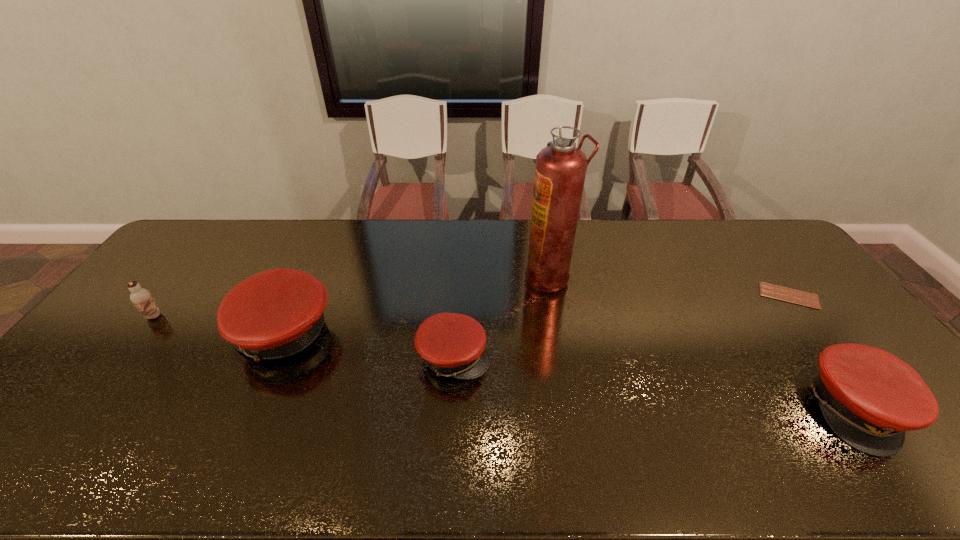
Locate an element on the screen. This screenshot has width=960, height=540. free location located 0.080m on the front of the tallest cap with an emblem is located at coordinates (202, 334).

Find the location of a particular element. vacant area located on the front of the tallest cap with an emblem is located at coordinates (174, 334).

This screenshot has width=960, height=540. I want to click on free spot located 0.150m on the front of the tallest cap with an emblem, so click(x=178, y=334).

At what (x,y) coordinates should I click in order to perform the action: click on vacant space situated on the front of the third object from left to right with an emblem. Please return your answer as a coordinate pair (x, y). Looking at the image, I should click on (600, 356).

Locate an element on the screen. The width and height of the screenshot is (960, 540). vacant region located 0.270m on the front of the shortest object is located at coordinates (857, 384).

This screenshot has width=960, height=540. Identify the location of free region located 0.130m on the side of the fire extinguisher with the label. (485, 277).

Locate an element on the screen. free location located on the side of the fire extinguisher with the label is located at coordinates (479, 277).

Locate an element on the screen. vacant space situated on the side of the fire extinguisher with the label is located at coordinates coord(473,277).

This screenshot has width=960, height=540. What are the coordinates of `free space located 0.200m on the back of the leftmost object` in the screenshot? It's located at (190, 268).

You are a GUI agent. You are given a task and a screenshot of the screen. Output one action in this format:
    pyautogui.click(x=<x>, y=<y>)
    Task: Click on the object present at the near edge
    Image resolution: width=960 pixels, height=540 pixels.
    Given the screenshot: What is the action you would take?
    tap(869, 397)